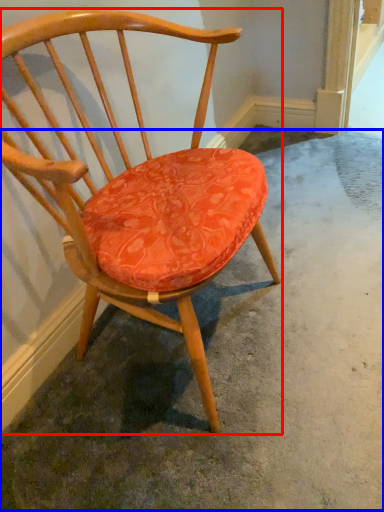
Question: Which point is further to the camera, chair (highlighted by a red box) or concrete (highlighted by a blue box)?

Choices:
 (A) chair
 (B) concrete

Answer: (B)